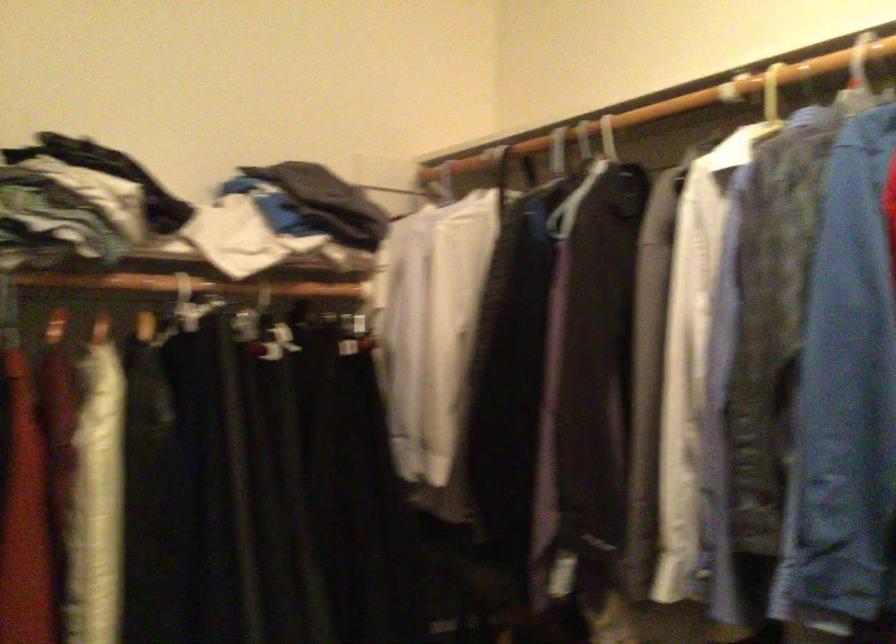
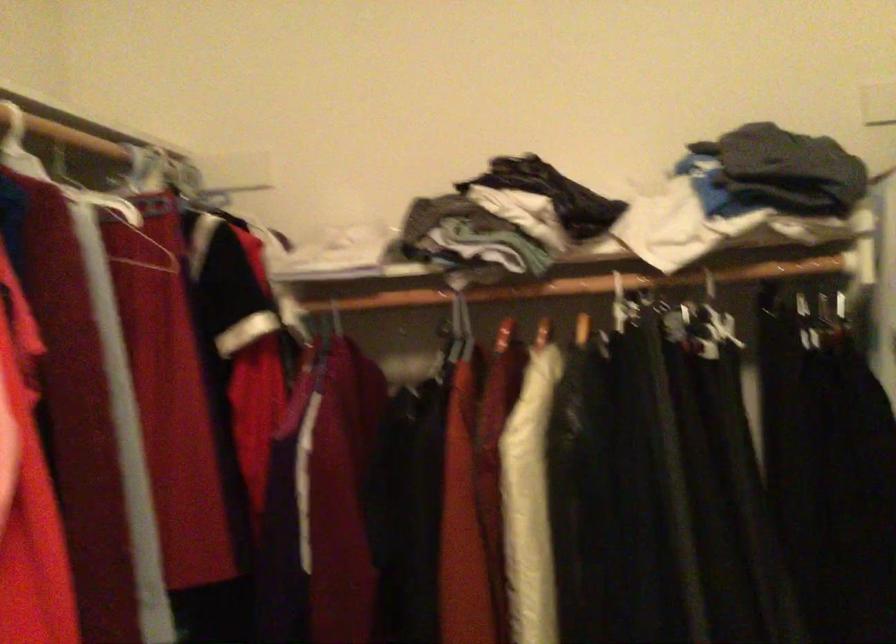
Question: The images are taken continuously from a first-person perspective. In which direction is your viewpoint rotating?

Choices:
 (A) Left
 (B) Right
 (C) Up
 (D) Down

Answer: (A)